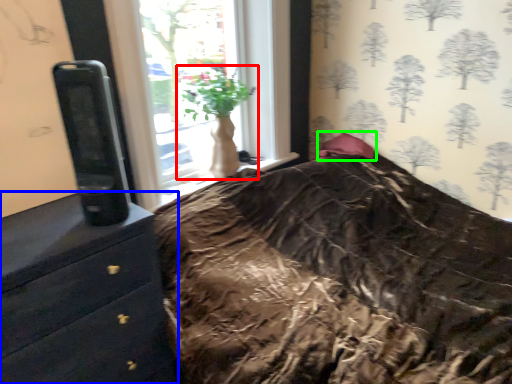
Question: Based on their relative distances, which object is nearer to houseplant (highlighted by a red box)? Choose from chest of drawers (highlighted by a blue box) and pillow (highlighted by a green box).

Choices:
 (A) chest of drawers
 (B) pillow

Answer: (B)